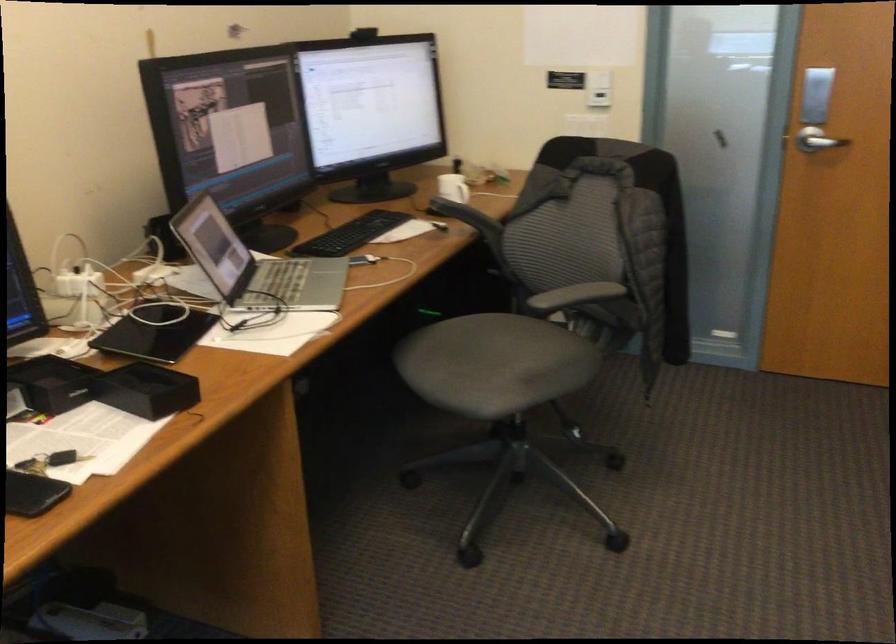
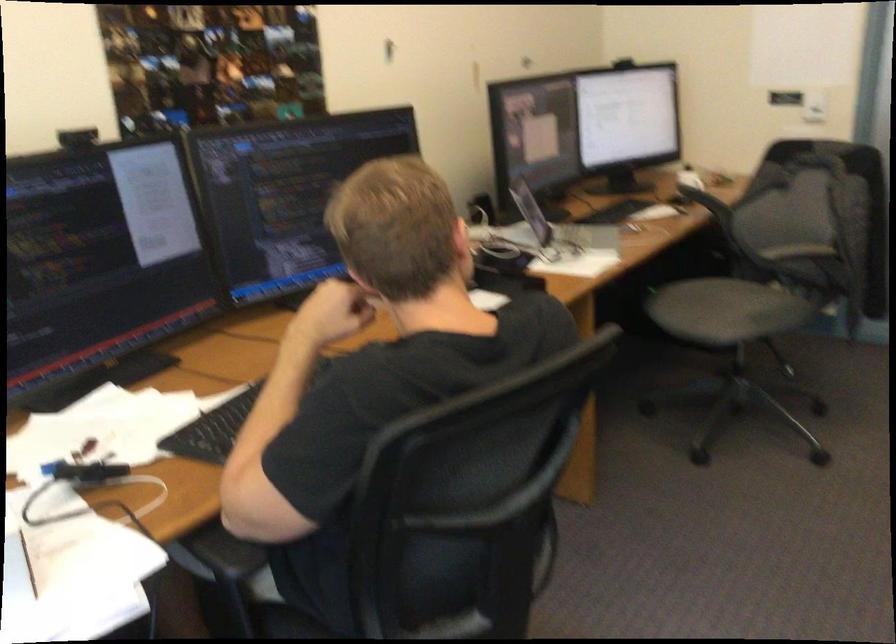
The point at (270, 277) is marked in the first image. Where is the corresponding point in the second image?

(561, 230)